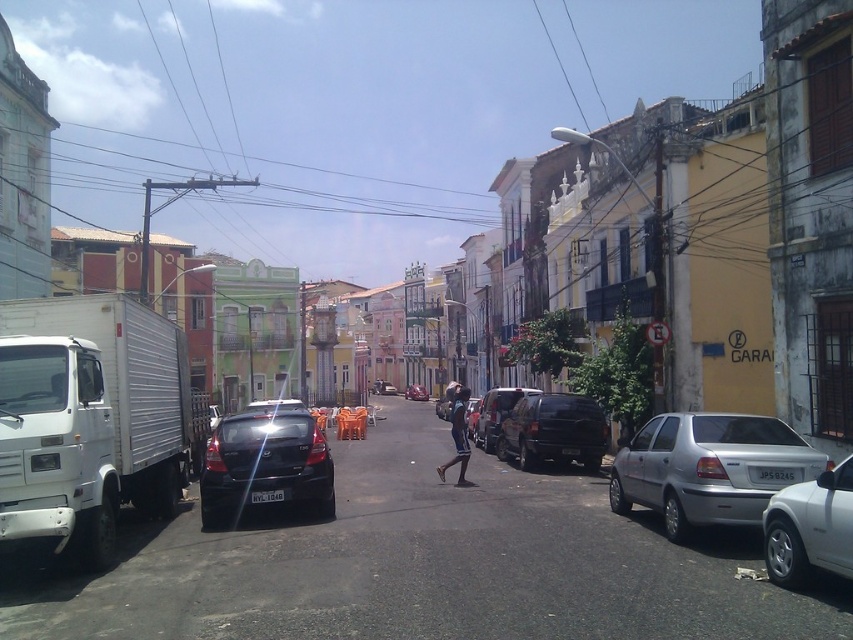
You are standing on the street looking at the buildings. There are two points marked on the image, one at point (543,452) and another at point (492,408). Which point is closer to you?

Point (543,452) is closer to the camera than point (492,408).

You are a delivery driver who needs to park your shiny black hatchback at center in this street. The parking spot you want is located at point 0.728, 0.312. Is your vehicle already parked in the correct spot?

Yes, the shiny black hatchback at center is already parked at point (265, 465), so it is in the correct spot.

You are a delivery driver who needs to park your truck in a specific spot marked at coordinates 0.884, 0.498. You see a white matte truck at left in the scene. Is there already a vehicle parked at the required coordinates?

Yes, the white matte truck at left is already parked at the coordinates (424, 564), so the delivery driver cannot park there.